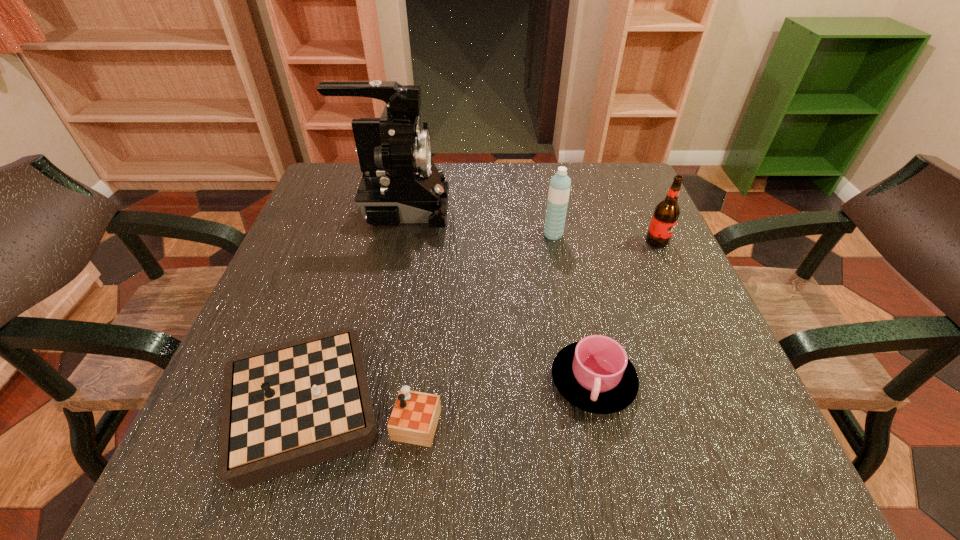
In the image, there is a desktop. In order to click on vacant space at the right edge in this screenshot , I will do `click(656, 318)`.

Image resolution: width=960 pixels, height=540 pixels. In order to click on free space at the far left corner of the desktop in this screenshot , I will do `click(358, 164)`.

The width and height of the screenshot is (960, 540). I want to click on vacant space at the far right corner of the desktop, so click(610, 189).

Where is `vacant space that is in between the cup and the rightmost object`? This screenshot has width=960, height=540. vacant space that is in between the cup and the rightmost object is located at coordinates (625, 311).

Where is `free point between the chessboard and the cup`? free point between the chessboard and the cup is located at coordinates (462, 393).

Image resolution: width=960 pixels, height=540 pixels. In order to click on unoccupied position between the cup and the water bottle in this screenshot , I will do `click(573, 307)`.

The width and height of the screenshot is (960, 540). Find the location of `vacant space that is in between the root beer and the tallest object`. vacant space that is in between the root beer and the tallest object is located at coordinates (528, 225).

You are a GUI agent. You are given a task and a screenshot of the screen. Output one action in this format:
    pyautogui.click(x=<x>, y=<y>)
    Task: Click on the blank region between the chessboard and the water bottle
    The height and width of the screenshot is (540, 960).
    Given the screenshot: What is the action you would take?
    pyautogui.click(x=442, y=320)

Where is `vacant region between the chessboard and the water bottle`? This screenshot has width=960, height=540. vacant region between the chessboard and the water bottle is located at coordinates (442, 320).

Where is `vacant space that's between the water bottle and the chessboard`? Image resolution: width=960 pixels, height=540 pixels. vacant space that's between the water bottle and the chessboard is located at coordinates (442, 320).